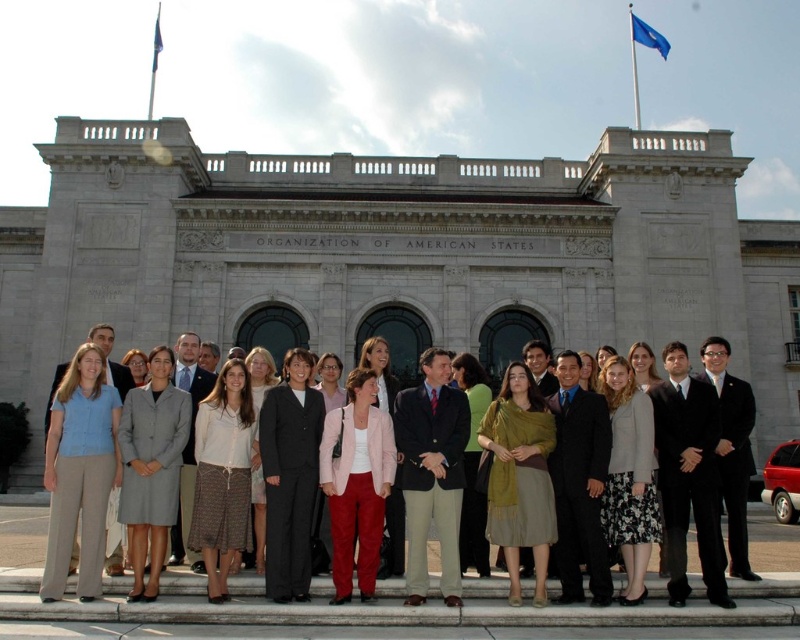
Question: Considering the relative positions of dark blue suit at center and black suit at center in the image provided, where is dark blue suit at center located with respect to black suit at center?

Choices:
 (A) right
 (B) left

Answer: (B)

Question: Which point is closer to the camera?

Choices:
 (A) (66, 563)
 (B) (656, 49)
 (C) (448, 460)

Answer: (A)

Question: Among these objects, which one is farthest from the camera?

Choices:
 (A) white fabric flag at upper left
 (B) dark blue suit at center
 (C) blue fabric flag at upper right

Answer: (A)

Question: In this image, where is black suit at center located relative to blue fabric flag at upper right?

Choices:
 (A) below
 (B) above

Answer: (A)

Question: Which point is farther to the camera?

Choices:
 (A) dark blue suit at center
 (B) white fabric flag at upper left
 (C) black suit at center
 (D) blue fabric flag at upper right

Answer: (B)

Question: Can you confirm if light blue shirt at center is positioned to the right of black suit at center?

Choices:
 (A) yes
 (B) no

Answer: (B)